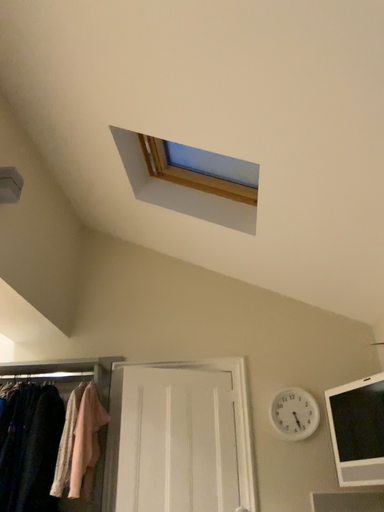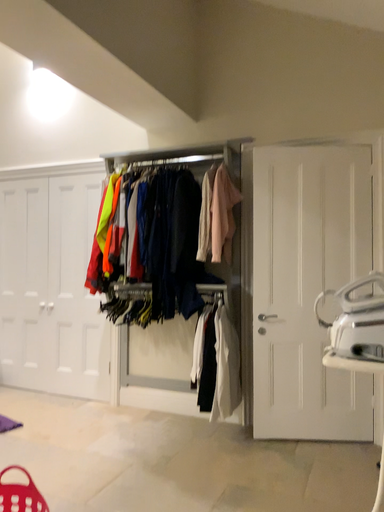
Question: How did the camera likely rotate when shooting the video?

Choices:
 (A) rotated left
 (B) rotated right

Answer: (A)